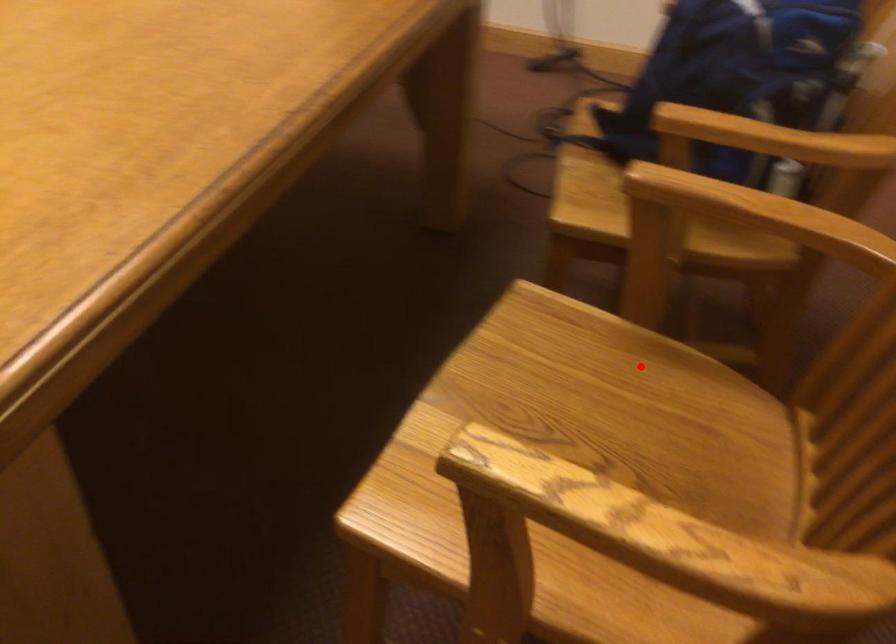
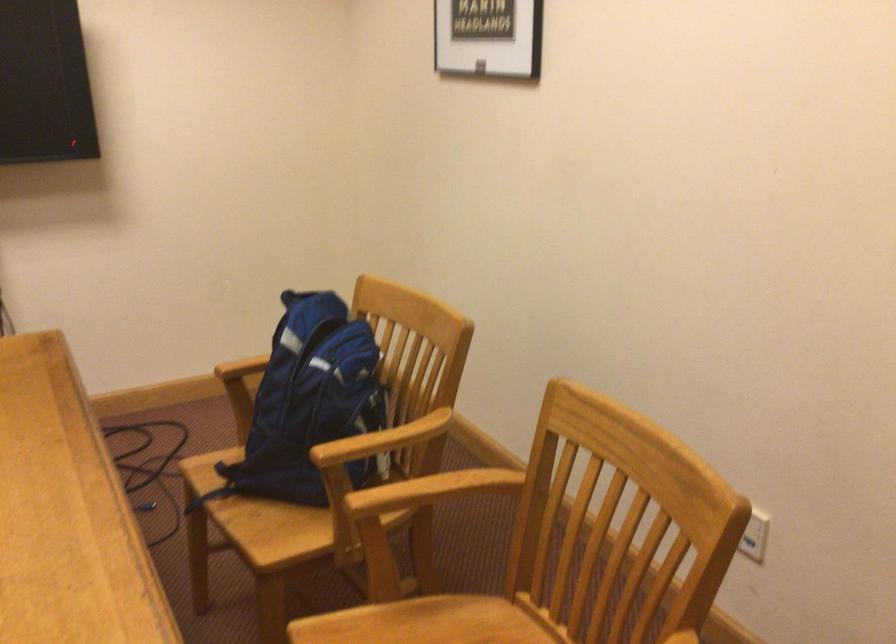
Question: I am providing you with two images of the same scene from different viewpoints. Given a red point in image1, look at the same physical point in image2. Is it:

Choices:
 (A) Closer to the viewpoint
 (B) Farther from the viewpoint

Answer: (B)